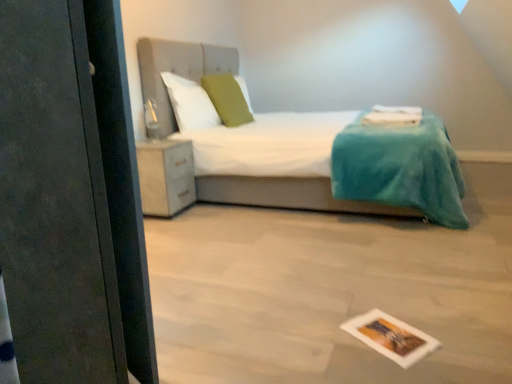
What do you see at coordinates (190, 103) in the screenshot?
I see `white soft pillow at upper center, which is counted as the first pillow, starting from the left` at bounding box center [190, 103].

What do you see at coordinates (366, 177) in the screenshot?
I see `white fabric bed at center` at bounding box center [366, 177].

This screenshot has width=512, height=384. What are the coordinates of `green fabric pillow at center, the 1th pillow positioned from the right` in the screenshot? It's located at (227, 99).

The height and width of the screenshot is (384, 512). Describe the element at coordinates (165, 176) in the screenshot. I see `matte white cabinet at lower left` at that location.

The image size is (512, 384). Identify the location of matte black screen door at left. (55, 201).

Considering the positions of points (36, 93) and (282, 202), is point (36, 93) closer to camera compared to point (282, 202)?

That is True.

Are matte black screen door at left and white fabric bed at center making contact?

They are not placed beside each other.

Is matte black screen door at left aimed at white fabric bed at center?

No, matte black screen door at left is not facing towards white fabric bed at center.

Locate an element on the screen. screen door to the left of white fabric bed at center is located at coordinates (55, 201).

Is matte white cabinet at lower left closer to camera compared to white fabric bed at center?

No, it is not.

Which point is more distant from viewer, (184, 174) or (464, 226)?

The point (184, 174) is farther from the camera.

From a real-world perspective, is matte white cabinet at lower left under white fabric bed at center?

Correct, in the physical world, matte white cabinet at lower left is lower than white fabric bed at center.

Measure the distance between matte white cabinet at lower left and white fabric bed at center.

The distance of matte white cabinet at lower left from white fabric bed at center is 23.42 inches.

Is white fabric bed at center closer to camera compared to matte white cabinet at lower left?

That is True.

Considering the points (276, 198) and (177, 167), which point is in front, point (276, 198) or point (177, 167)?

The point (177, 167) is in front.

From the picture: Are white fabric bed at center and matte white cabinet at lower left beside each other?

No, white fabric bed at center is not in contact with matte white cabinet at lower left.

Is white fabric bed at center facing away from matte white cabinet at lower left?

white fabric bed at center is not turned away from matte white cabinet at lower left.

Between printed paper postcard at lower center and white fabric bed at center, which one appears on the left side from the viewer's perspective?

Positioned to the left is printed paper postcard at lower center.

Is printed paper postcard at lower center positioned far away from white fabric bed at center?

Indeed, printed paper postcard at lower center is not near white fabric bed at center.

Between printed paper postcard at lower center and white fabric bed at center, which one has smaller width?

printed paper postcard at lower center.

Is printed paper postcard at lower center inside the boundaries of white fabric bed at center, or outside?

printed paper postcard at lower center cannot be found inside white fabric bed at center.

How different are the orientations of white soft pillow at upper center, which is counted as the first pillow, starting from the left, and matte white cabinet at lower left in degrees?

There is a 4.48-degree angle between the facing directions of white soft pillow at upper center, which is counted as the first pillow, starting from the left, and matte white cabinet at lower left.

Considering the sizes of objects white soft pillow at upper center, which is the second pillow in right-to-left order, and matte white cabinet at lower left in the image provided, who is bigger, white soft pillow at upper center, which is the second pillow in right-to-left order, or matte white cabinet at lower left?

Bigger between the two is matte white cabinet at lower left.

Can you confirm if white soft pillow at upper center, which is counted as the first pillow, starting from the left, is wider than matte white cabinet at lower left?

No, white soft pillow at upper center, which is counted as the first pillow, starting from the left, is not wider than matte white cabinet at lower left.

From a real-world perspective, which object rests below the other?

matte white cabinet at lower left, from a real-world perspective.

How distant is matte black screen door at left from printed paper postcard at lower center?

They are 3.84 feet apart.

Considering the relative sizes of matte black screen door at left and printed paper postcard at lower center in the image provided, is matte black screen door at left wider than printed paper postcard at lower center?

Indeed, matte black screen door at left has a greater width compared to printed paper postcard at lower center.

Based on the photo, is matte black screen door at left turned away from printed paper postcard at lower center?

No, matte black screen door at left is not facing the opposite direction of printed paper postcard at lower center.

At what (x,y) coordinates should I click in order to perform the action: click on screen door that is above the printed paper postcard at lower center (from the image's perspective). Please return your answer as a coordinate pair (x, y). Image resolution: width=512 pixels, height=384 pixels. Looking at the image, I should click on (55, 201).

Considering the relative positions of matte black screen door at left and white soft pillow at upper center, which is the second pillow in right-to-left order, in the image provided, is matte black screen door at left behind white soft pillow at upper center, which is the second pillow in right-to-left order,?

No, the depth of matte black screen door at left is less than that of white soft pillow at upper center, which is the second pillow in right-to-left order.

From a real-world perspective, which object rests below the other?

In real-world perspective, matte black screen door at left is lower.

Can you confirm if matte black screen door at left is positioned to the right of white soft pillow at upper center, which is the second pillow in right-to-left order?

Indeed, matte black screen door at left is positioned on the right side of white soft pillow at upper center, which is the second pillow in right-to-left order.

Is matte black screen door at left not close to white soft pillow at upper center, which is counted as the first pillow, starting from the left?

matte black screen door at left is positioned a significant distance from white soft pillow at upper center, which is counted as the first pillow, starting from the left.

At what (x,y) coordinates should I click in order to perform the action: click on screen door that appears below the white fabric bed at center (from a real-world perspective). Please return your answer as a coordinate pair (x, y). This screenshot has height=384, width=512. Looking at the image, I should click on (55, 201).

I want to click on bed in front of the matte white cabinet at lower left, so click(366, 177).

Considering their positions, is matte black screen door at left positioned closer to green fabric pillow at center, the 2th pillow in the left-to-right sequence, than white soft pillow at upper center, which is counted as the first pillow, starting from the left?

Based on the image, white soft pillow at upper center, which is counted as the first pillow, starting from the left, appears to be nearer to green fabric pillow at center, the 2th pillow in the left-to-right sequence.

Based on the photo, which object lies nearer to the anchor point green fabric pillow at center, the 1th pillow positioned from the right, printed paper postcard at lower center or matte white cabinet at lower left?

matte white cabinet at lower left is positioned closer to the anchor green fabric pillow at center, the 1th pillow positioned from the right.

Based on their spatial positions, is matte white cabinet at lower left or matte black screen door at left further from green fabric pillow at center, the 1th pillow positioned from the right?

The object further to green fabric pillow at center, the 1th pillow positioned from the right, is matte black screen door at left.

From the image, which object appears to be farther from green fabric pillow at center, the 1th pillow positioned from the right, matte white cabinet at lower left or printed paper postcard at lower center?

Based on the image, printed paper postcard at lower center appears to be further to green fabric pillow at center, the 1th pillow positioned from the right.

Considering their positions, is white soft pillow at upper center, which is the second pillow in right-to-left order, positioned further to green fabric pillow at center, the 2th pillow in the left-to-right sequence, than printed paper postcard at lower center?

Based on the image, printed paper postcard at lower center appears to be further to green fabric pillow at center, the 2th pillow in the left-to-right sequence.

In the scene shown: From the image, which object appears to be nearer to white fabric bed at center, white soft pillow at upper center, which is the second pillow in right-to-left order, or matte black screen door at left?

white soft pillow at upper center, which is the second pillow in right-to-left order, is closer to white fabric bed at center.

Based on their spatial positions, is printed paper postcard at lower center or matte black screen door at left closer to white fabric bed at center?

Among the two, printed paper postcard at lower center is located nearer to white fabric bed at center.

Which object lies further to the anchor point printed paper postcard at lower center, white soft pillow at upper center, which is counted as the first pillow, starting from the left, or green fabric pillow at center, the 1th pillow positioned from the right?

green fabric pillow at center, the 1th pillow positioned from the right, is positioned further to the anchor printed paper postcard at lower center.

Locate an element on the screen. pillow positioned between matte black screen door at left and green fabric pillow at center, the 1th pillow positioned from the right, from near to far is located at coordinates (190, 103).

The image size is (512, 384). Find the location of `bed between printed paper postcard at lower center and green fabric pillow at center, the 1th pillow positioned from the right, from front to back`. bed between printed paper postcard at lower center and green fabric pillow at center, the 1th pillow positioned from the right, from front to back is located at coordinates (366, 177).

Where is `pillow between green fabric pillow at center, the 1th pillow positioned from the right, and matte white cabinet at lower left in the up-down direction`? The height and width of the screenshot is (384, 512). pillow between green fabric pillow at center, the 1th pillow positioned from the right, and matte white cabinet at lower left in the up-down direction is located at coordinates (190, 103).

You are a GUI agent. You are given a task and a screenshot of the screen. Output one action in this format:
    pyautogui.click(x=<x>, y=<y>)
    Task: Click on the pillow between printed paper postcard at lower center and green fabric pillow at center, the 2th pillow in the left-to-right sequence, from front to back
    The width and height of the screenshot is (512, 384).
    Given the screenshot: What is the action you would take?
    pyautogui.click(x=190, y=103)